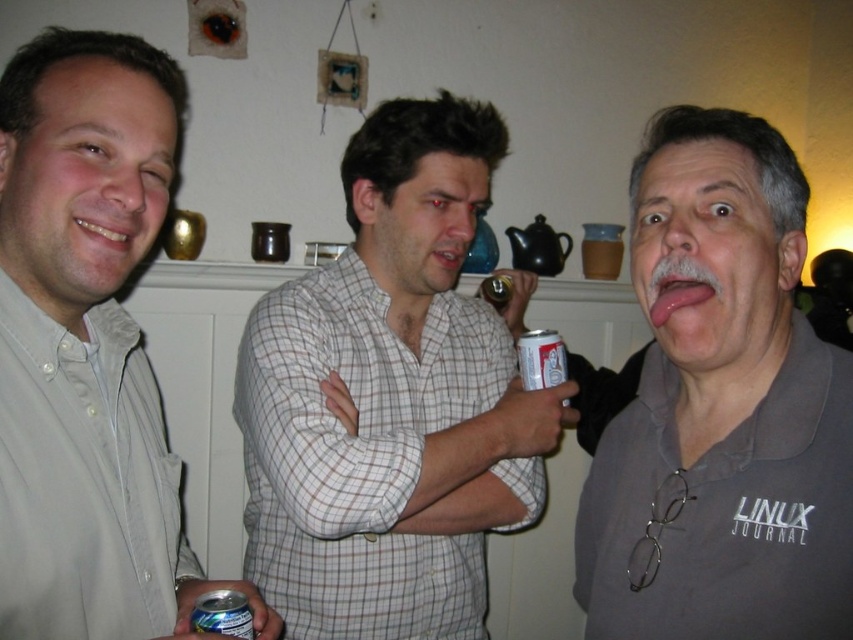
Question: Which object appears closest to the camera in this image?

Choices:
 (A) pink flesh at center
 (B) white paper can at center
 (C) light beige shirt at left
 (D) white checkered shirt at center

Answer: (C)

Question: Is the position of white checkered shirt at center less distant than that of blue metallic can at center?

Choices:
 (A) no
 (B) yes

Answer: (A)

Question: Can you confirm if light beige shirt at left is wider than blue metallic can at center?

Choices:
 (A) no
 (B) yes

Answer: (B)

Question: Which point is farther to the camera?

Choices:
 (A) white paper can at center
 (B) gray fabric shirt at center
 (C) light beige shirt at left

Answer: (A)

Question: Does gray fabric shirt at center appear on the right side of blue metallic can at center?

Choices:
 (A) yes
 (B) no

Answer: (A)

Question: Among these points, which one is nearest to the camera?

Choices:
 (A) (656, 276)
 (B) (405, 195)
 (C) (746, 541)
 (D) (190, 616)

Answer: (C)